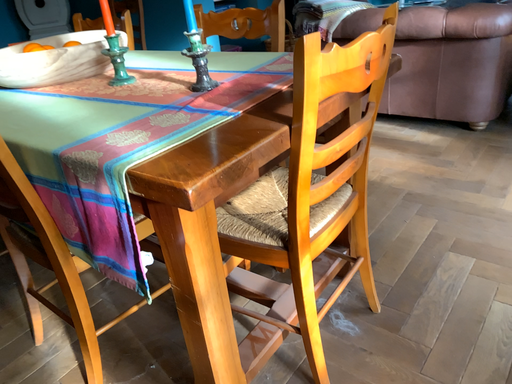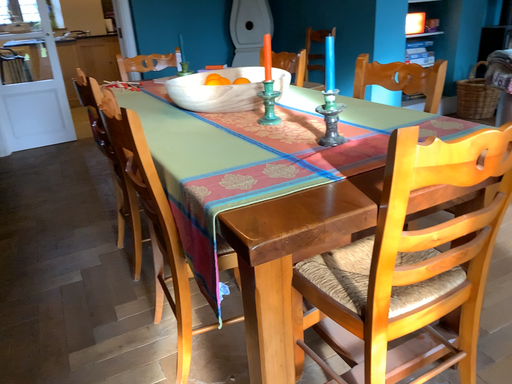
Question: How did the camera likely rotate when shooting the video?

Choices:
 (A) rotated right
 (B) rotated left

Answer: (B)